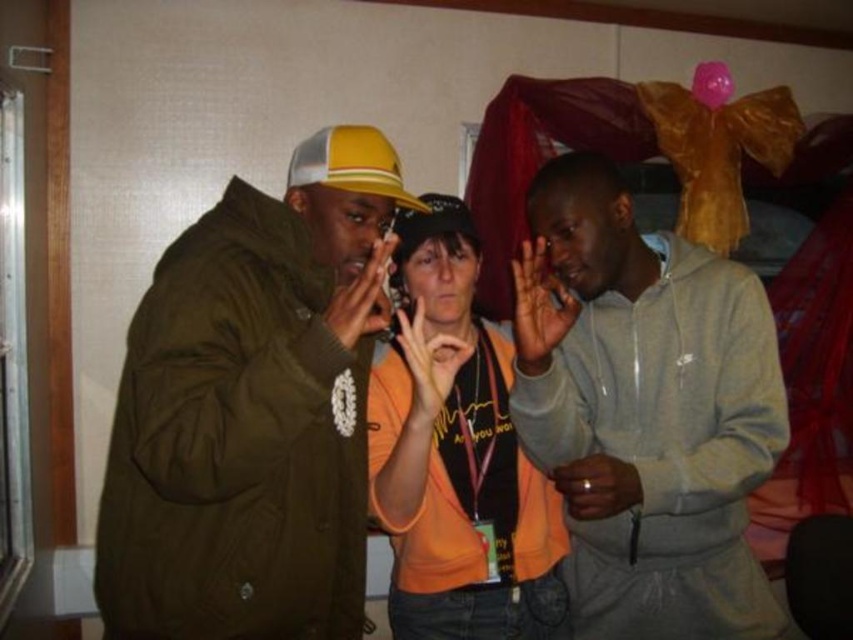
Question: Which point appears closest to the camera in this image?

Choices:
 (A) [585, 202]
 (B) [358, 189]
 (C) [318, 550]

Answer: (C)

Question: Is the position of olive green jacket at left less distant than that of yellow mesh baseball cap at upper left?

Choices:
 (A) no
 (B) yes

Answer: (B)

Question: Does olive green jacket at left have a larger size compared to yellow mesh baseball cap at upper left?

Choices:
 (A) yes
 (B) no

Answer: (A)

Question: Does olive green jacket at left have a smaller size compared to orange fabric shirt at center?

Choices:
 (A) no
 (B) yes

Answer: (A)

Question: Estimate the real-world distances between objects in this image. Which object is farther from the matte yellow baseball cap at center?

Choices:
 (A) orange fabric shirt at center
 (B) yellow mesh baseball cap at upper left
 (C) olive green jacket at left
 (D) gray hoodie at center

Answer: (C)

Question: Among these points, which one is nearest to the camera?

Choices:
 (A) (431, 314)
 (B) (363, 150)
 (C) (416, 221)
 (D) (265, 259)

Answer: (D)